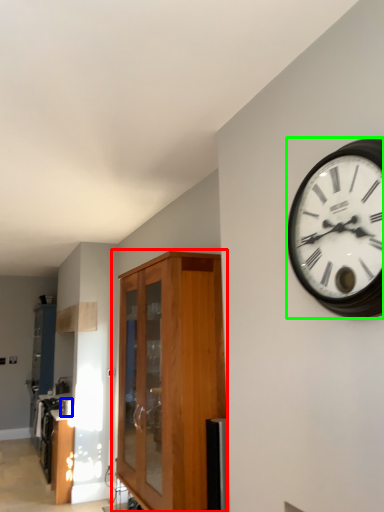
Question: Estimate the real-world distances between objects in this image. Which object is closer to cabinetry (highlighted by a red box), appliance (highlighted by a blue box) or wall clock (highlighted by a green box)?

Choices:
 (A) appliance
 (B) wall clock

Answer: (B)